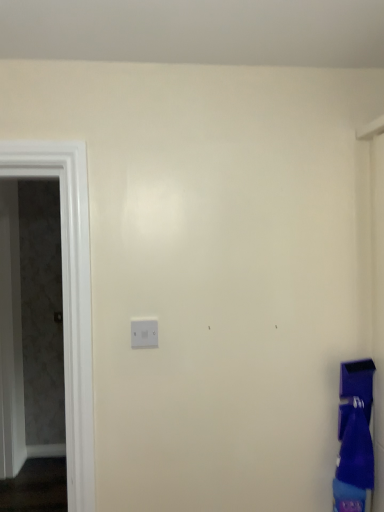
The height and width of the screenshot is (512, 384). I want to click on matte gray screen door at left, so click(x=69, y=297).

What is the approximate height of matte gray screen door at left?

It is 1.19 meters.

Measure the distance between matte gray screen door at left and camera.

The depth of matte gray screen door at left is 1.29 meters.

The height and width of the screenshot is (512, 384). What do you see at coordinates (69, 297) in the screenshot?
I see `matte gray screen door at left` at bounding box center [69, 297].

This screenshot has height=512, width=384. What do you see at coordinates (354, 438) in the screenshot?
I see `matte blue laundry at lower right` at bounding box center [354, 438].

The image size is (384, 512). I want to click on matte blue laundry at lower right, so click(354, 438).

Where is `matte gray screen door at left`? matte gray screen door at left is located at coordinates (69, 297).

Looking at this image, is matte gray screen door at left at the left side of matte blue laundry at lower right?

Indeed, matte gray screen door at left is positioned on the left side of matte blue laundry at lower right.

In the image, is matte gray screen door at left positioned in front of or behind matte blue laundry at lower right?

Visually, matte gray screen door at left is located behind matte blue laundry at lower right.

Does point (75, 494) come in front of point (364, 453)?

No, it is behind (364, 453).

From the image's perspective, which one is positioned lower, matte gray screen door at left or matte blue laundry at lower right?

From the image's view, matte blue laundry at lower right is below.

From a real-world perspective, which is physically below, matte gray screen door at left or matte blue laundry at lower right?

From a 3D spatial view, matte blue laundry at lower right is below.

From the picture: Can you confirm if matte gray screen door at left is thinner than matte blue laundry at lower right?

Yes.

Who is shorter, matte gray screen door at left or matte blue laundry at lower right?

Standing shorter between the two is matte blue laundry at lower right.

Based on the photo, can you confirm if matte gray screen door at left is bigger than matte blue laundry at lower right?

Yes.

Would you say matte blue laundry at lower right is part of matte gray screen door at left's contents?

No, matte gray screen door at left does not contain matte blue laundry at lower right.

Is matte gray screen door at left placed right next to matte blue laundry at lower right?

matte gray screen door at left and matte blue laundry at lower right are not in contact.

Consider the image. Is matte gray screen door at left facing away from matte blue laundry at lower right?

No, matte gray screen door at left is not facing away from matte blue laundry at lower right.

You are a GUI agent. You are given a task and a screenshot of the screen. Output one action in this format:
    pyautogui.click(x=<x>, y=<y>)
    Task: Click on the laundry that appears below the matte gray screen door at left (from a real-world perspective)
    The image size is (384, 512).
    Given the screenshot: What is the action you would take?
    pyautogui.click(x=354, y=438)

Is matte blue laundry at lower right to the left or to the right of matte gray screen door at left in the image?

In the image, matte blue laundry at lower right appears on the right side of matte gray screen door at left.

In the image, is matte blue laundry at lower right positioned in front of or behind matte gray screen door at left?

Visually, matte blue laundry at lower right is located in front of matte gray screen door at left.

Which is in front, point (366, 362) or point (78, 184)?

Point (78, 184)

From the image's perspective, between matte blue laundry at lower right and matte gray screen door at left, who is located below?

From the image's view, matte blue laundry at lower right is below.

From a real-world perspective, is matte blue laundry at lower right positioned above or below matte gray screen door at left?

matte blue laundry at lower right is situated lower than matte gray screen door at left in the real world.

Does matte blue laundry at lower right have a lesser width compared to matte gray screen door at left?

Incorrect, the width of matte blue laundry at lower right is not less than that of matte gray screen door at left.

Which of these two, matte blue laundry at lower right or matte gray screen door at left, stands taller?

matte gray screen door at left is taller.

In the scene shown: Considering the relative sizes of matte blue laundry at lower right and matte gray screen door at left in the image provided, is matte blue laundry at lower right smaller than matte gray screen door at left?

Correct, matte blue laundry at lower right occupies less space than matte gray screen door at left.

Consider the image. Is matte blue laundry at lower right situated inside matte gray screen door at left or outside?

matte blue laundry at lower right is not enclosed by matte gray screen door at left.

Is matte blue laundry at lower right placed right next to matte gray screen door at left?

No, matte blue laundry at lower right is not with matte gray screen door at left.

Is matte blue laundry at lower right aimed at matte gray screen door at left?

No, matte blue laundry at lower right does not turn towards matte gray screen door at left.

What are the coordinates of `laundry lying below the matte gray screen door at left (from the image's perspective)` in the screenshot? It's located at pos(354,438).

Find the location of a particular element. This screenshot has width=384, height=512. screen door behind the matte blue laundry at lower right is located at coordinates (69, 297).

In the image, there is a matte gray screen door at left. At what (x,y) coordinates should I click in order to perform the action: click on laundry below it (from the image's perspective). Please return your answer as a coordinate pair (x, y). Image resolution: width=384 pixels, height=512 pixels. Looking at the image, I should click on (354, 438).